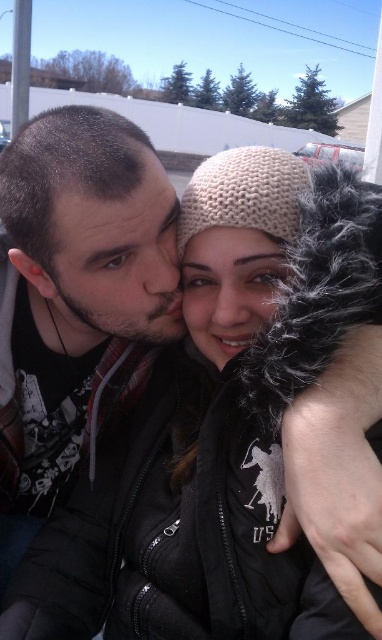
Is the position of dark brown hair at left less distant than that of matte beige knit hat at center?

That is False.

Is point (158, 269) closer to viewer compared to point (192, 243)?

No, (158, 269) is behind (192, 243).

Locate an element on the screen. dark brown hair at left is located at coordinates (119, 259).

Between matte black jacket at left and matte beige knit hat at center, which one has less height?

Standing shorter between the two is matte beige knit hat at center.

Is matte black jacket at left to the right of matte beige knit hat at center from the viewer's perspective?

In fact, matte black jacket at left is to the left of matte beige knit hat at center.

Who is more distant from viewer, (40, 141) or (226, 333)?

Point (226, 333)

Where is `matte black jacket at left`? Image resolution: width=382 pixels, height=640 pixels. matte black jacket at left is located at coordinates [x=77, y=289].

Consider the image. Which is more to the left, matte black jacket at left or dark brown hair at left?

matte black jacket at left is more to the left.

Does matte black jacket at left have a lesser height compared to dark brown hair at left?

Incorrect, matte black jacket at left's height does not fall short of dark brown hair at left's.

Which is in front, point (166, 266) or point (150, 316)?

Point (166, 266) is more forward.

Image resolution: width=382 pixels, height=640 pixels. I want to click on matte black jacket at left, so (77, 289).